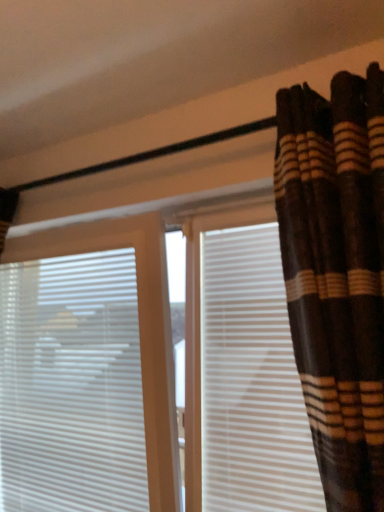
Question: Considering the relative sizes of white matte shutter at right and white plastic blinds at left in the image provided, is white matte shutter at right thinner than white plastic blinds at left?

Choices:
 (A) yes
 (B) no

Answer: (A)

Question: Is white plastic blinds at left completely or partially inside white matte shutter at right?

Choices:
 (A) no
 (B) yes

Answer: (A)

Question: From a real-world perspective, is white matte shutter at right positioned over white plastic blinds at left based on gravity?

Choices:
 (A) yes
 (B) no

Answer: (A)

Question: Is the position of white matte shutter at right more distant than that of white plastic blinds at left?

Choices:
 (A) yes
 (B) no

Answer: (B)

Question: From the image's perspective, would you say white matte shutter at right is shown under white plastic blinds at left?

Choices:
 (A) no
 (B) yes

Answer: (A)

Question: From the image's perspective, is white matte shutter at right on white plastic blinds at left?

Choices:
 (A) no
 (B) yes

Answer: (B)

Question: Considering the relative sizes of brown striped fabric at upper right and white matte shutter at right in the image provided, is brown striped fabric at upper right taller than white matte shutter at right?

Choices:
 (A) no
 (B) yes

Answer: (B)

Question: Is brown striped fabric at upper right behind white matte shutter at right?

Choices:
 (A) no
 (B) yes

Answer: (A)

Question: Can white matte shutter at right be found inside brown striped fabric at upper right?

Choices:
 (A) no
 (B) yes

Answer: (A)

Question: From the image's perspective, is brown striped fabric at upper right over white matte shutter at right?

Choices:
 (A) yes
 (B) no

Answer: (A)

Question: Does brown striped fabric at upper right have a greater width compared to white matte shutter at right?

Choices:
 (A) yes
 (B) no

Answer: (A)

Question: Is brown striped fabric at upper right to the right of white matte shutter at right from the viewer's perspective?

Choices:
 (A) yes
 (B) no

Answer: (A)

Question: From the image's perspective, is white plastic blinds at left located above brown striped fabric at upper right?

Choices:
 (A) no
 (B) yes

Answer: (A)